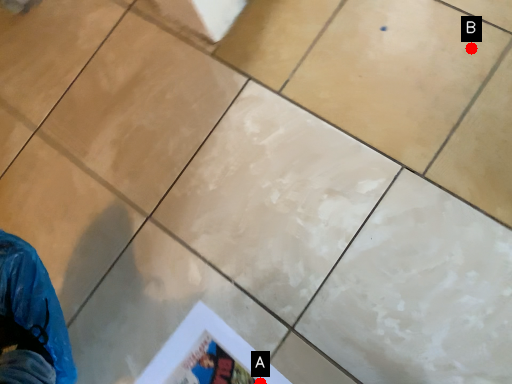
Question: Two points are circled on the image, labeled by A and B beside each circle. Which point is farther to the camera?

Choices:
 (A) A is further
 (B) B is further

Answer: (B)